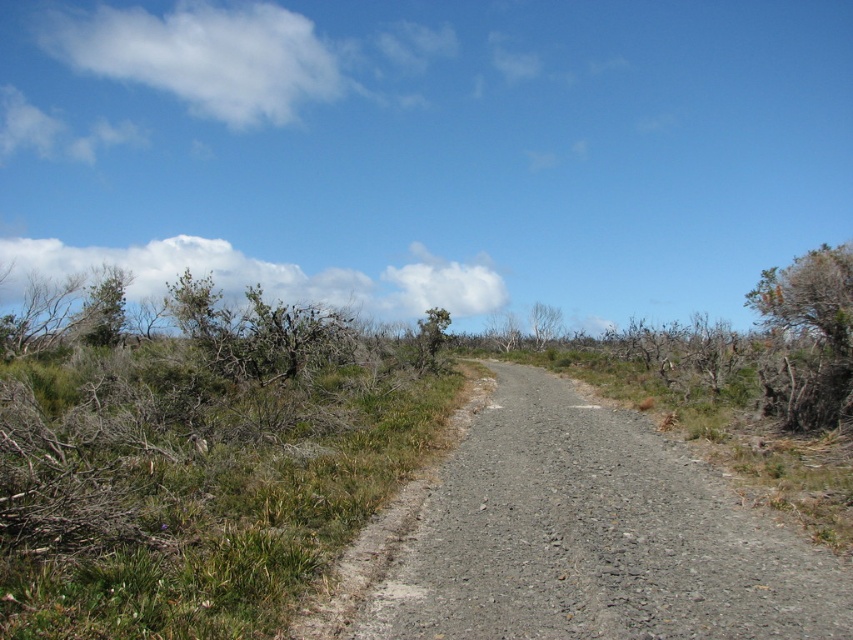
Is brown textured bush at right wider than bare branches at center?

Indeed, brown textured bush at right has a greater width compared to bare branches at center.

Does brown textured bush at right appear on the right side of bare branches at center?

Yes, brown textured bush at right is to the right of bare branches at center.

Is point (843, 401) positioned before point (537, 333)?

That is True.

The width and height of the screenshot is (853, 640). I want to click on brown textured bush at right, so click(x=808, y=337).